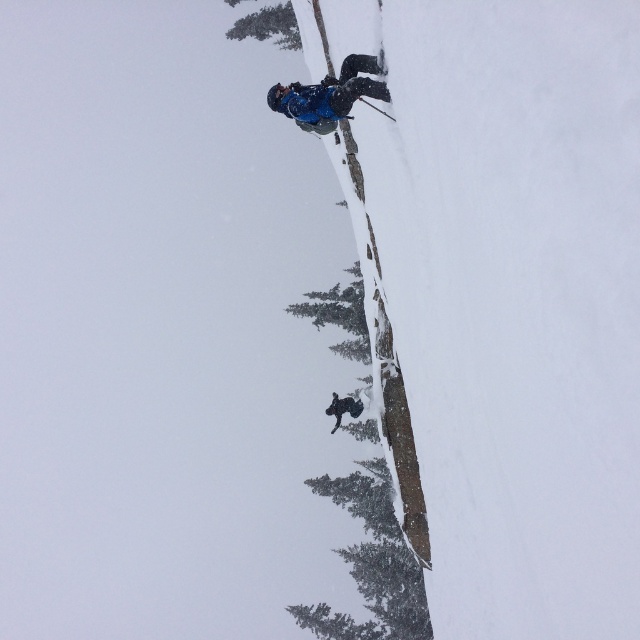
Is green textured pine tree at upper center bigger than matte black ski at center?

Indeed, green textured pine tree at upper center has a larger size compared to matte black ski at center.

Is point (276, 33) less distant than point (337, 424)?

No, (276, 33) is further to viewer.

What do you see at coordinates (268, 26) in the screenshot?
I see `green textured pine tree at upper center` at bounding box center [268, 26].

Identify the location of green textured pine tree at upper center. Image resolution: width=640 pixels, height=640 pixels. (268, 26).

Is point (349, 80) in front of point (333, 432)?

Yes, it is.

Can you confirm if blue matte jacket at upper center is positioned to the left of matte black ski at center?

No, blue matte jacket at upper center is not to the left of matte black ski at center.

Who is more forward, (356, 74) or (339, 417)?

Point (356, 74) is in front.

Locate an element on the screen. The width and height of the screenshot is (640, 640). blue matte jacket at upper center is located at coordinates (330, 92).

Is blue matte jacket at upper center positioned at the back of green textured pine tree at upper center?

No, it is in front of green textured pine tree at upper center.

Which of these two, blue matte jacket at upper center or green textured pine tree at upper center, stands taller?

green textured pine tree at upper center

Identify the location of blue matte jacket at upper center. (330, 92).